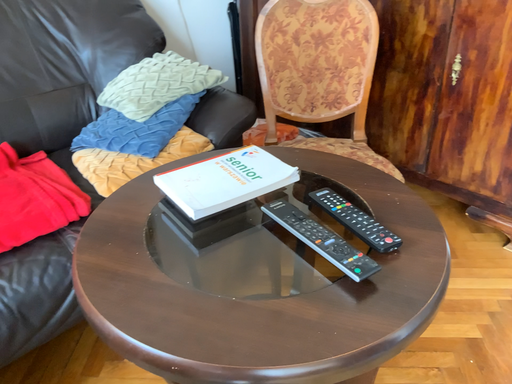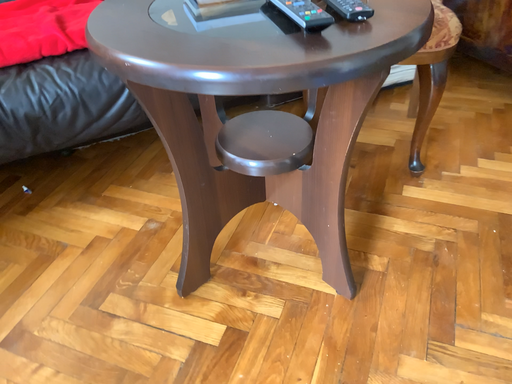
Question: How did the camera likely rotate when shooting the video?

Choices:
 (A) rotated downward
 (B) rotated upward

Answer: (A)